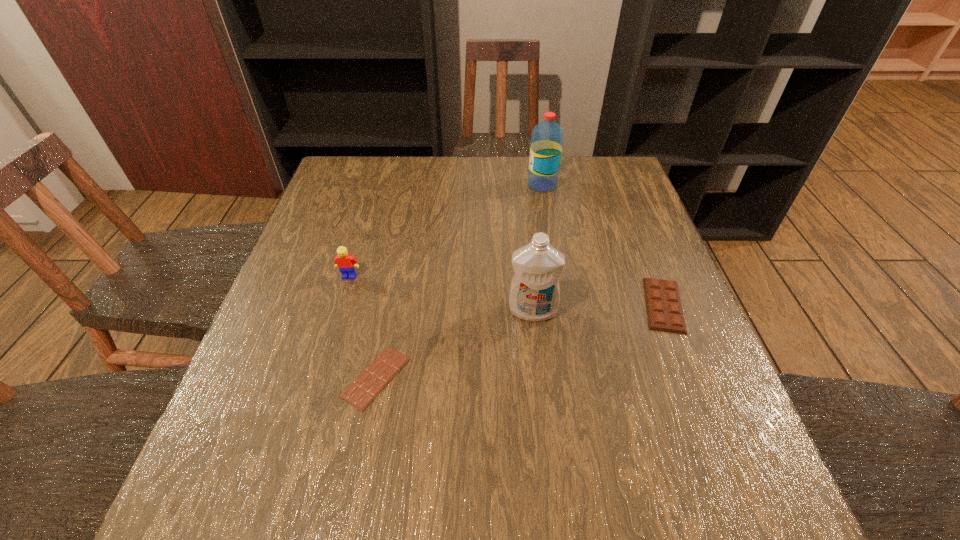
The image size is (960, 540). I want to click on free space between the farther chocolate bar and the third shortest object, so click(x=506, y=291).

Select which object appears as the third closest to the water bottle. Please provide its 2D coordinates. Your answer should be formatted as a tuple, i.e. [(x, y)], where the tuple contains the x and y coordinates of a point satisfying the conditions above.

[(346, 263)]

Identify which object is located as the second nearest to the detergent. Please provide its 2D coordinates. Your answer should be formatted as a tuple, i.e. [(x, y)], where the tuple contains the x and y coordinates of a point satisfying the conditions above.

[(364, 389)]

I want to click on free space that satisfies the following two spatial constraints: 1. on the front-facing side of the shortest object; 2. on the right side of the Lego, so click(319, 377).

The height and width of the screenshot is (540, 960). I want to click on vacant area that satisfies the following two spatial constraints: 1. on the back side of the farther chocolate bar; 2. on the front label of the farthest object, so click(616, 185).

Locate an element on the screen. Image resolution: width=960 pixels, height=540 pixels. free space that satisfies the following two spatial constraints: 1. on the front label of the farthest object; 2. on the front-facing side of the third shortest object is located at coordinates (559, 276).

Identify the location of free spot that satisfies the following two spatial constraints: 1. on the front label of the farthest object; 2. on the front-facing side of the third shortest object. (559, 276).

This screenshot has width=960, height=540. What are the coordinates of `free space in the image that satisfies the following two spatial constraints: 1. on the front-facing side of the nearest object; 2. on the right side of the leftmost object` in the screenshot? It's located at (319, 377).

Locate an element on the screen. The width and height of the screenshot is (960, 540). vacant position in the image that satisfies the following two spatial constraints: 1. on the back side of the second object from left to right; 2. on the right side of the second shortest object is located at coordinates (390, 305).